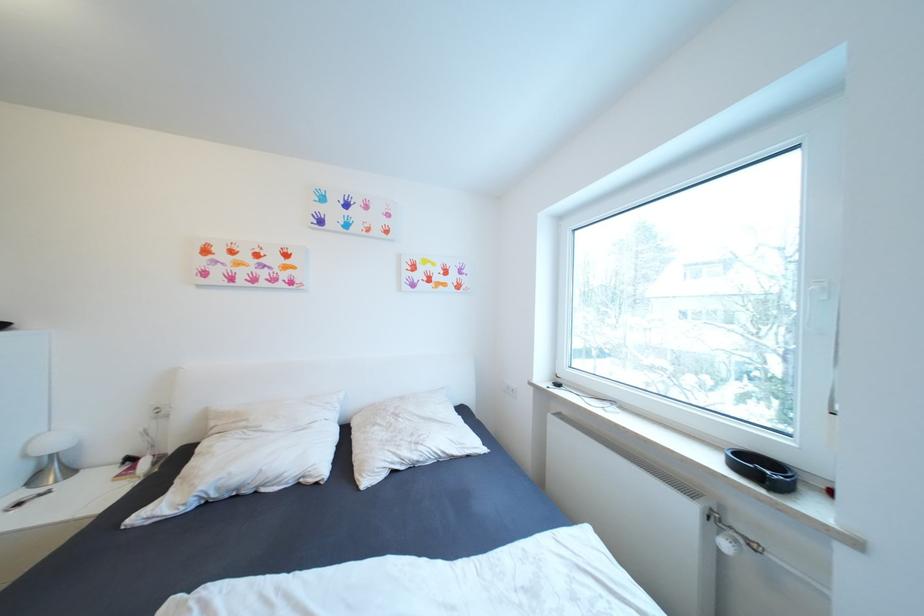
I want to click on radiator thermostat knob, so click(728, 543).